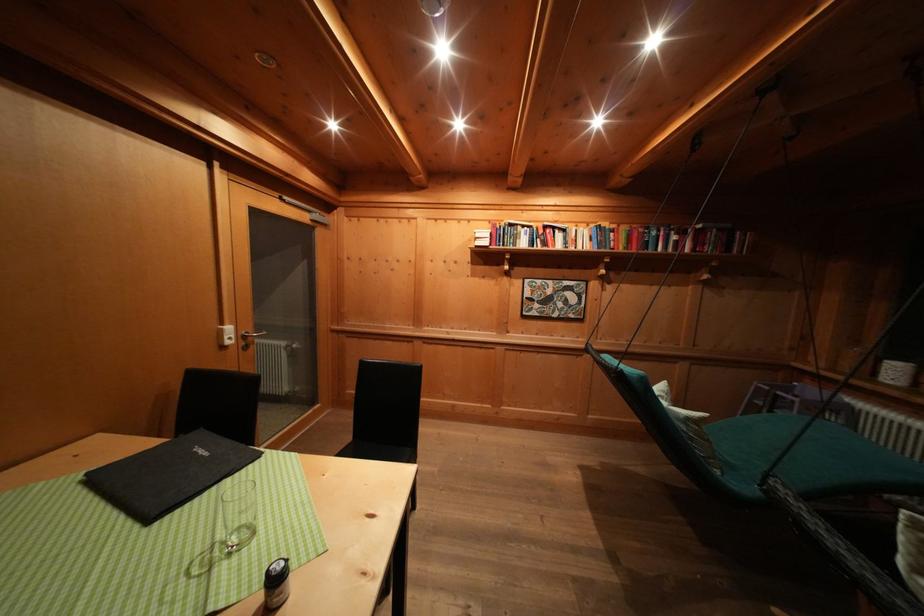
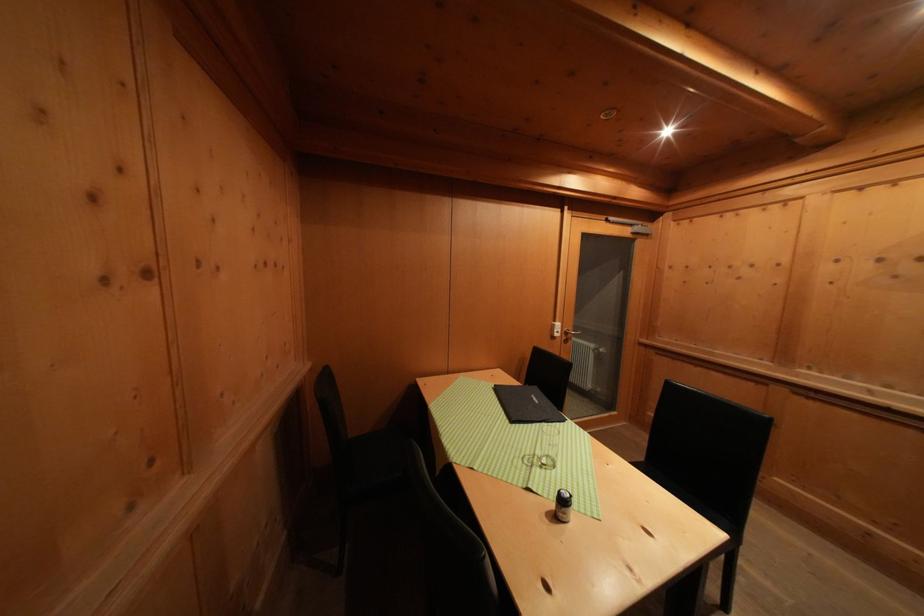
Locate, in the second image, the point that corresponds to pixel 220 493 in the first image.

(543, 429)